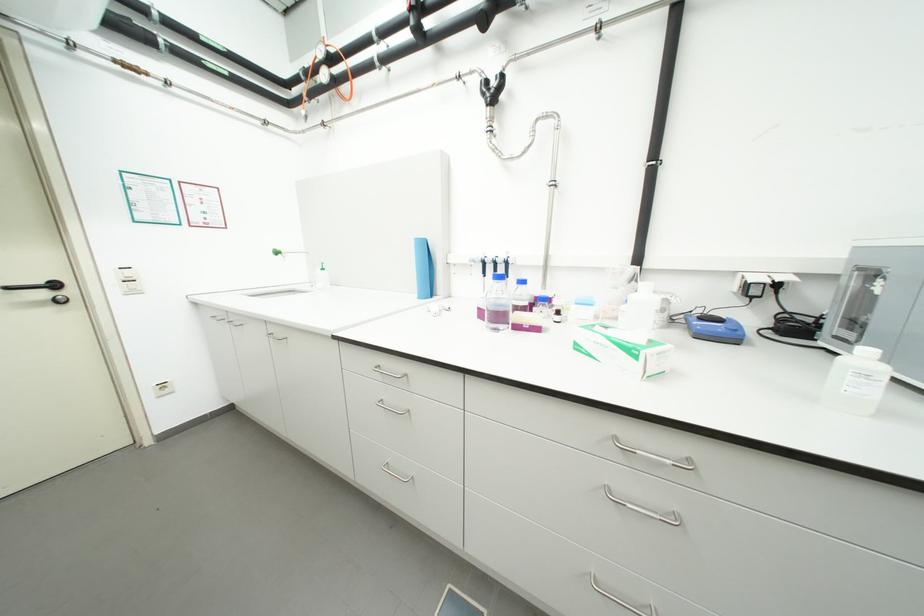
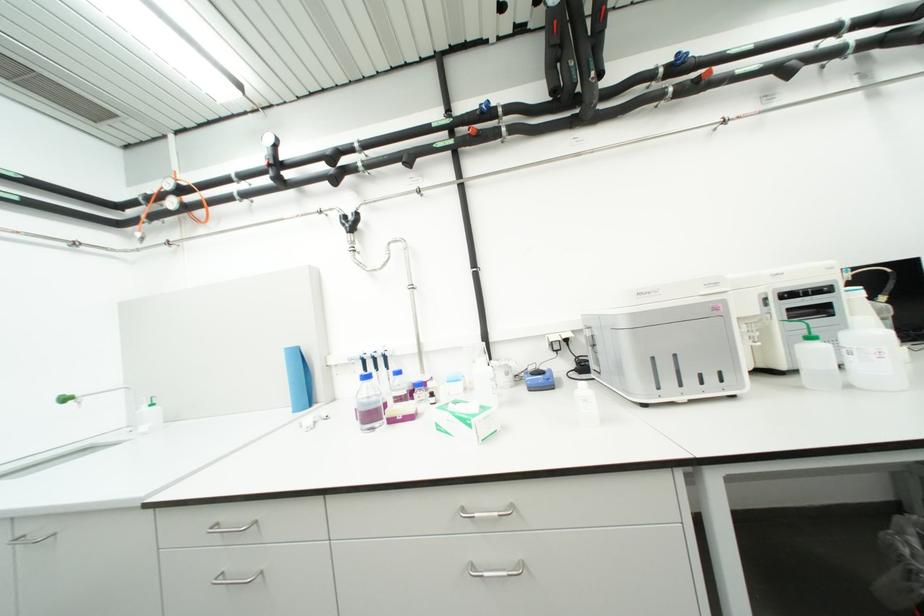
The point at (586, 349) is marked in the first image. Where is the corresponding point in the second image?

(446, 429)